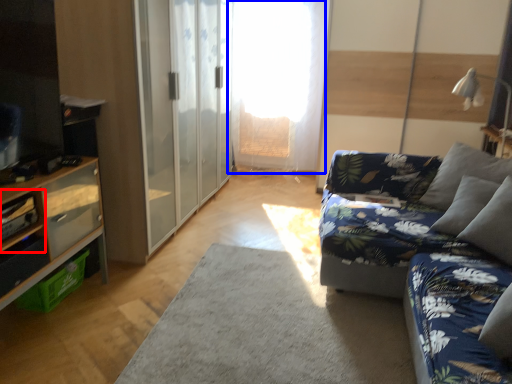
Question: Which object is further to the camera taking this photo, shelf (highlighted by a red box) or window screen (highlighted by a blue box)?

Choices:
 (A) shelf
 (B) window screen

Answer: (B)